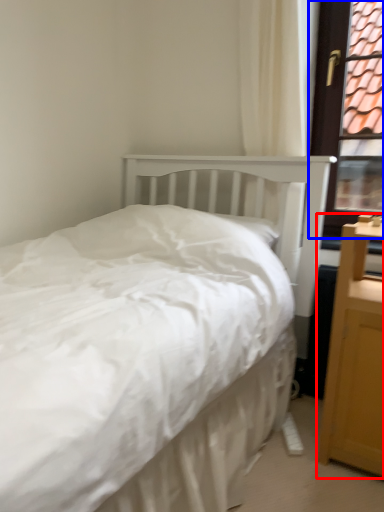
Question: Which point is further to the camera, nightstand (highlighted by a red box) or window frame (highlighted by a blue box)?

Choices:
 (A) nightstand
 (B) window frame

Answer: (B)